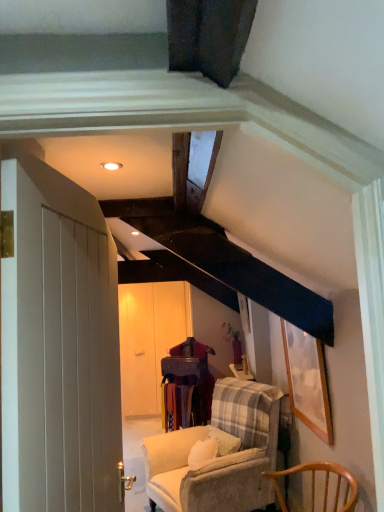
Question: Is white wooden door at left surrounded by velvet beige armchair at center, the second chair viewed from the front?

Choices:
 (A) yes
 (B) no

Answer: (B)

Question: From a real-world perspective, does velvet beige armchair at center, the second chair viewed from the front, sit lower than white wooden door at left?

Choices:
 (A) no
 (B) yes

Answer: (B)

Question: From the image's perspective, does velvet beige armchair at center, which is counted as the first chair, starting from the back, appear lower than white wooden door at left?

Choices:
 (A) no
 (B) yes

Answer: (B)

Question: Is velvet beige armchair at center, the second chair viewed from the front, at the left side of white wooden door at left?

Choices:
 (A) yes
 (B) no

Answer: (B)

Question: Is velvet beige armchair at center, the second chair viewed from the front, not inside white wooden door at left?

Choices:
 (A) yes
 (B) no

Answer: (A)

Question: From the image's perspective, relative to velvet beige armchair at center, the second chair viewed from the front, is wooden picture frame at upper right above or below?

Choices:
 (A) below
 (B) above

Answer: (B)

Question: From their relative heights in the image, would you say wooden picture frame at upper right is taller or shorter than velvet beige armchair at center, which is counted as the first chair, starting from the back?

Choices:
 (A) short
 (B) tall

Answer: (A)

Question: Considering the positions of wooden picture frame at upper right and velvet beige armchair at center, the second chair viewed from the front, in the image, is wooden picture frame at upper right wider or thinner than velvet beige armchair at center, the second chair viewed from the front,?

Choices:
 (A) wide
 (B) thin

Answer: (B)

Question: Visually, is wooden picture frame at upper right positioned to the left or to the right of velvet beige armchair at center, which is counted as the first chair, starting from the back?

Choices:
 (A) left
 (B) right

Answer: (B)

Question: From the image's perspective, is wooden picture frame at upper right located above or below wooden chair at lower right, positioned as the first chair in front-to-back order?

Choices:
 (A) above
 (B) below

Answer: (A)

Question: Is point (288, 326) positioned closer to the camera than point (297, 465)?

Choices:
 (A) closer
 (B) farther

Answer: (B)

Question: Considering the relative positions of wooden picture frame at upper right and wooden chair at lower right, positioned as the first chair in front-to-back order, in the image provided, is wooden picture frame at upper right to the left or to the right of wooden chair at lower right, positioned as the first chair in front-to-back order,?

Choices:
 (A) left
 (B) right

Answer: (B)

Question: From a real-world perspective, is wooden picture frame at upper right physically located above or below wooden chair at lower right, positioned as the first chair in front-to-back order?

Choices:
 (A) above
 (B) below

Answer: (A)

Question: From the image's perspective, relative to wooden picture frame at upper right, is velvet beige armchair at center, which is counted as the first chair, starting from the back, above or below?

Choices:
 (A) below
 (B) above

Answer: (A)

Question: Visually, is velvet beige armchair at center, which is counted as the first chair, starting from the back, positioned to the left or to the right of wooden picture frame at upper right?

Choices:
 (A) left
 (B) right

Answer: (A)